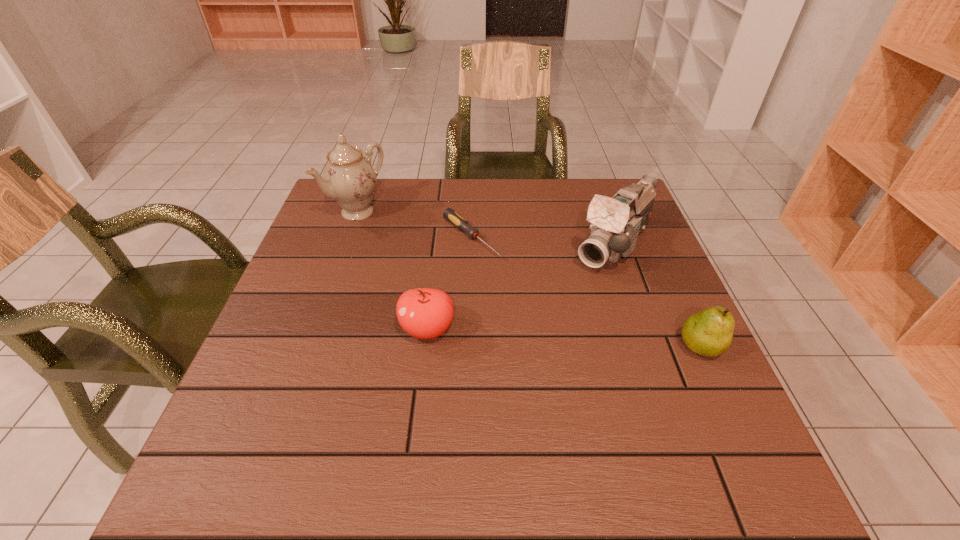
Image resolution: width=960 pixels, height=540 pixels. What are the coordinates of `vacant area between the apple and the shortest object` in the screenshot? It's located at (x=449, y=284).

Identify the location of free area in between the apple and the leftmost object. (393, 271).

Find the location of `free space between the apple and the shortest object`. free space between the apple and the shortest object is located at coordinates (449, 284).

Image resolution: width=960 pixels, height=540 pixels. In order to click on vacant area between the pear and the chinaware in this screenshot , I will do `click(529, 280)`.

Find the location of a particular element. This screenshot has width=960, height=540. unoccupied area between the apple and the pear is located at coordinates (564, 338).

Where is `vacant space in between the chinaware and the apple`? The width and height of the screenshot is (960, 540). vacant space in between the chinaware and the apple is located at coordinates (393, 271).

This screenshot has width=960, height=540. What are the coordinates of `free space between the shortest object and the pear` in the screenshot? It's located at (586, 292).

Image resolution: width=960 pixels, height=540 pixels. Identify the location of vacant region between the second tallest object and the screwdriver. (542, 241).

The image size is (960, 540). I want to click on free spot between the pear and the apple, so click(x=564, y=338).

Where is `object that ranks as the fourth closest to the fourth shortest object`? The image size is (960, 540). object that ranks as the fourth closest to the fourth shortest object is located at coordinates (349, 178).